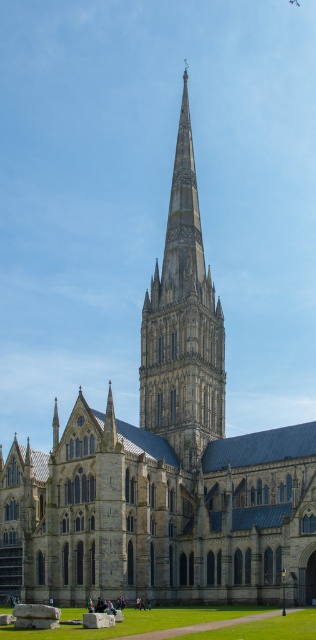
You are standing in the cathedral square and want to take a photo of both the central spire and the grassy area. You notice two points marked as point 1 at coordinates point [224,339] and point 2 at coordinates point [196,611]. Which point should you stand closer to in order to ensure both the spire and the grassy area are in focus?

You should stand closer to point 1 at coordinates point [224,339] because it is closer to the viewer than point 2 at coordinates point [196,611], allowing both the central spire and the grassy area to be in focus.

You are a landscape architect planning to install a new pathway between the gray stone spire at center and the green grass at lower center. The pathway must be exactly 30 meters long. Based on the current distance between these two landmarks, will the pathway be long enough to connect them without any adjustments?

The gray stone spire at center and green grass at lower center are 29.21 meters apart. Since the pathway is planned to be 30 meters long, which is longer than the existing distance, the pathway will be too long to connect them without adjustments. You would need to shorten it by approximately 0.79 meters to fit the space.